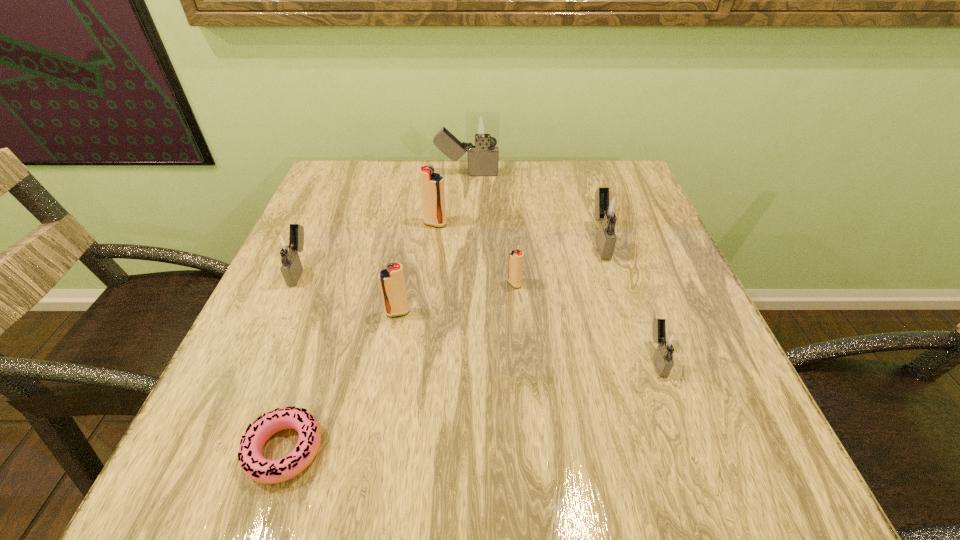
Identify the location of free space between the leftmost object and the biggest red igniter. Image resolution: width=960 pixels, height=540 pixels. (368, 246).

This screenshot has width=960, height=540. I want to click on free space between the third biggest gray igniter and the farthest gray igniter, so click(x=383, y=221).

Image resolution: width=960 pixels, height=540 pixels. I want to click on free point between the sixth object from left to right and the third smallest gray igniter, so click(557, 262).

Find the location of a particular element. The image size is (960, 540). vacant space in between the sixth farthest object and the third biggest gray igniter is located at coordinates (348, 291).

Locate an element on the screen. The width and height of the screenshot is (960, 540). object that stands as the seventh closest to the second igniter from left to right is located at coordinates (482, 128).

Locate which object is the second closest to the third smallest gray igniter. Please provide its 2D coordinates. Your answer should be formatted as a tuple, i.e. [(x, y)], where the tuple contains the x and y coordinates of a point satisfying the conditions above.

[(668, 343)]

Identify the location of igniter that can be found as the third closest to the doughnut. (515, 268).

Find the location of a particular element. igniter that is the second closest one to the leftmost red igniter is located at coordinates (515, 268).

Locate which gray igniter is the second closest to the third smallest gray igniter. Please provide its 2D coordinates. Your answer should be formatted as a tuple, i.e. [(x, y)], where the tuple contains the x and y coordinates of a point satisfying the conditions above.

[(482, 128)]

This screenshot has height=540, width=960. I want to click on the second closest gray igniter to the rightmost red igniter, so click(668, 343).